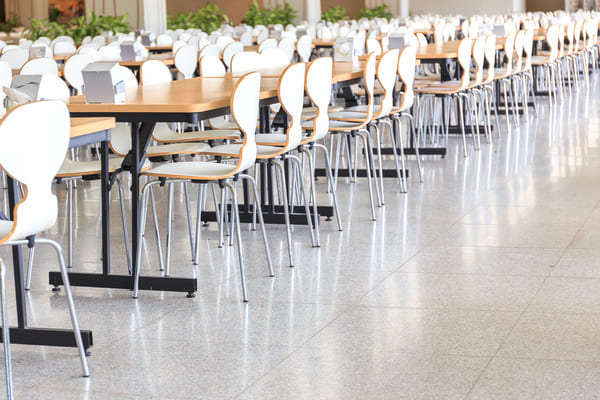
Image resolution: width=600 pixels, height=400 pixels. Find the location of `napkin dispenser`. napkin dispenser is located at coordinates (112, 79), (41, 87), (42, 50), (132, 50), (308, 30), (283, 32), (350, 57), (406, 40), (507, 28), (146, 34).